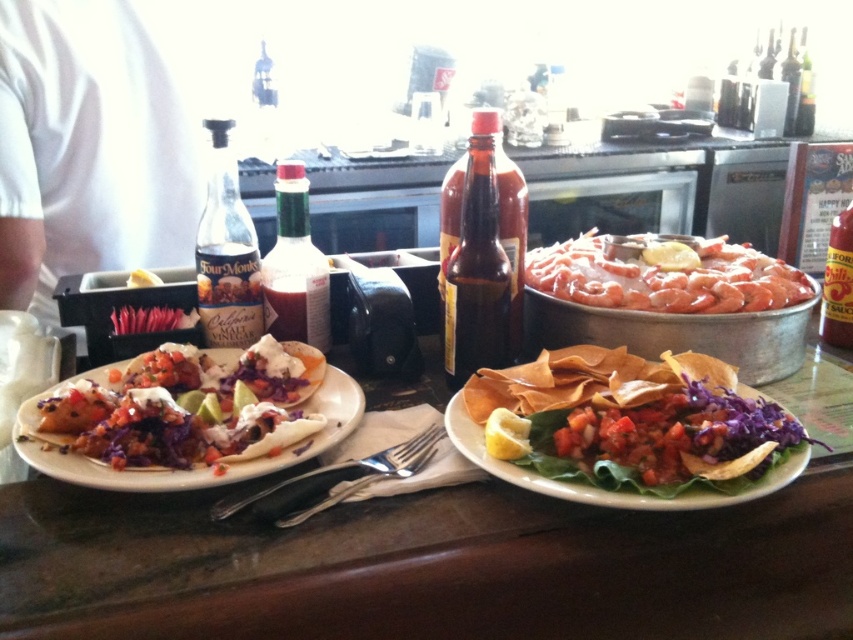
Question: Considering the relative positions of brown glass bottle at center and shiny silver taco at center in the image provided, where is brown glass bottle at center located with respect to shiny silver taco at center?

Choices:
 (A) below
 (B) above

Answer: (B)

Question: Is matte white tortilla at left positioned behind translucent glass bottle at upper right?

Choices:
 (A) no
 (B) yes

Answer: (A)

Question: Can you confirm if matte white tortilla at left is positioned above red glass hot sauce at right?

Choices:
 (A) no
 (B) yes

Answer: (A)

Question: Which of the following is the closest to the observer?

Choices:
 (A) satin silver fork at center
 (B) translucent glass bottle at upper right
 (C) green glass bottle at center

Answer: (A)

Question: Which object appears farthest from the camera in this image?

Choices:
 (A) matte white tortilla at left
 (B) satin silver fork at center
 (C) clear glass bottle at left

Answer: (C)

Question: Considering the real-world distances, which object is farthest from the satin silver fork at center?

Choices:
 (A) green glass bottle at center
 (B) brown glass bottle at center
 (C) shiny silver taco at center

Answer: (C)